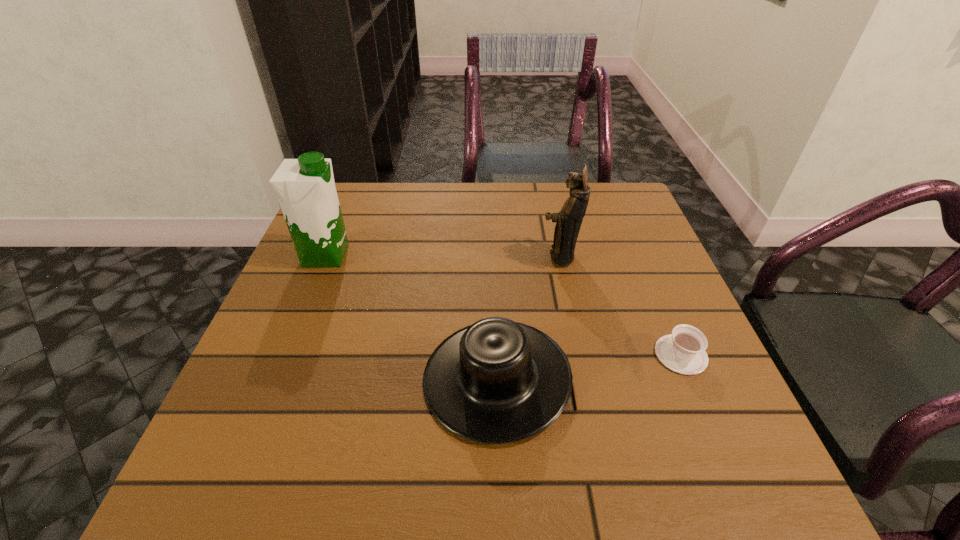
The width and height of the screenshot is (960, 540). Identify the location of soya milk. (305, 187).

Locate an element on the screen. figurine is located at coordinates (568, 221).

Find the location of a particular element. This screenshot has height=540, width=960. dress hat is located at coordinates (497, 381).

Find the location of a particular element. teacup is located at coordinates (683, 351).

You are a GUI agent. You are given a task and a screenshot of the screen. Output one action in this format:
    pyautogui.click(x=<x>, y=<y>)
    Task: Click on the shortest object
    
    Given the screenshot: What is the action you would take?
    pyautogui.click(x=683, y=351)

I want to click on free region located 0.190m on the front-facing side of the soya milk, so click(431, 255).

Identify the location of free region located 0.360m on the front-facing side of the figurine. (385, 257).

I want to click on vacant space located on the front-facing side of the figurine, so click(368, 257).

The image size is (960, 540). I want to click on blank space located 0.350m on the front-facing side of the figurine, so click(389, 257).

This screenshot has height=540, width=960. What are the coordinates of `free region located 0.200m on the back of the third tallest object` in the screenshot? It's located at (492, 259).